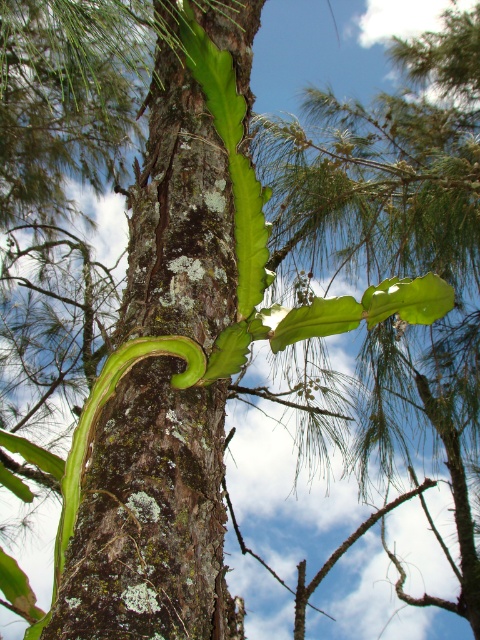
Does green rough bark tree trunk at center appear under green leafy plant at center?

Actually, green rough bark tree trunk at center is above green leafy plant at center.

Between point (103, 449) and point (106, 380), which one is positioned in front?

Positioned in front is point (103, 449).

Is point (85, 586) positioned in front of point (64, 472)?

Yes, point (85, 586) is closer to viewer.

This screenshot has height=640, width=480. In order to click on green rough bark tree trunk at center in this screenshot , I will do `click(149, 516)`.